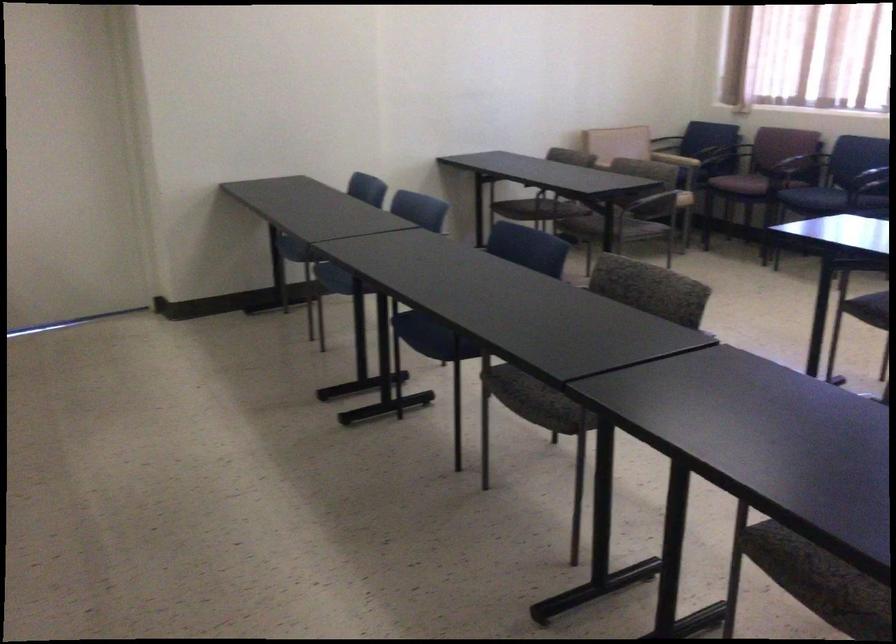
Where would you resting arm the dark blue chair armrest? Please return your answer as a coordinate pair (x, y).

(800, 160)